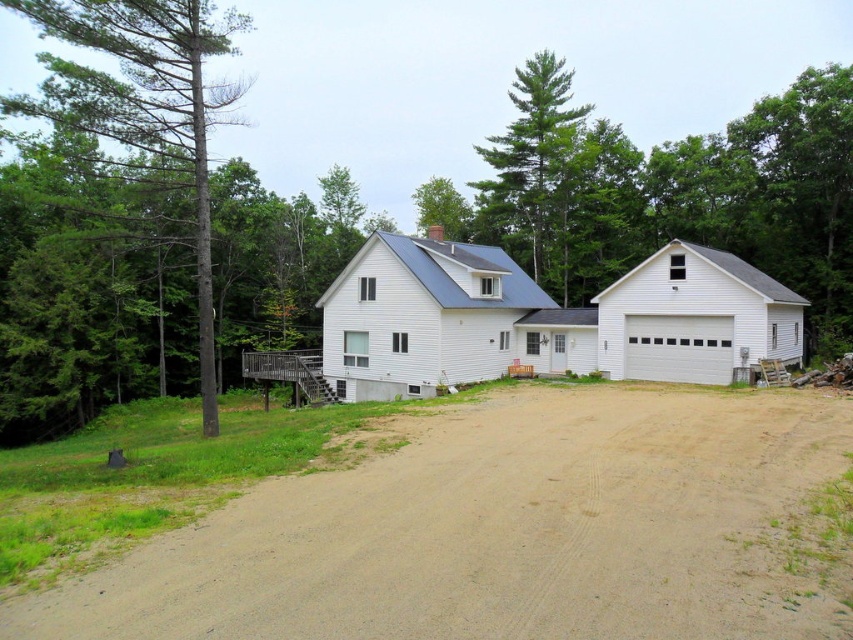
Question: Is white matte garage at center bigger than white matte garage at right?

Choices:
 (A) no
 (B) yes

Answer: (B)

Question: Which point is farther to the camera?

Choices:
 (A) (183, 588)
 (B) (82, 33)

Answer: (B)

Question: Which point is farther to the camera?

Choices:
 (A) white matte garage at center
 (B) green leafy tree at upper center

Answer: (B)

Question: Which point is farther to the camera?

Choices:
 (A) green leafy tree at upper center
 (B) white smooth garage at center

Answer: (A)

Question: Where is brown dirt at center located in relation to green textured pine tree at upper center in the image?

Choices:
 (A) left
 (B) right

Answer: (A)

Question: Does brown dirt at center have a smaller size compared to white smooth garage at center?

Choices:
 (A) yes
 (B) no

Answer: (A)